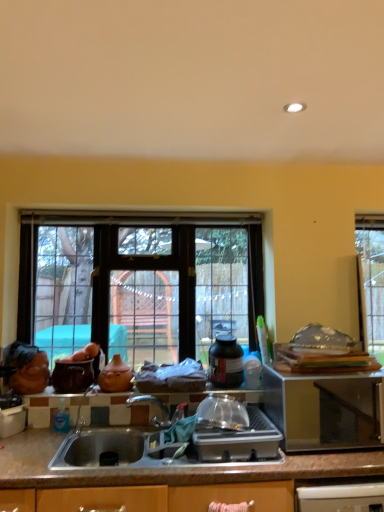
Question: From the image's perspective, is stainless steel microwave at right, which ranks as the second appliance in left-to-right order, positioned above or below matte brown pot at left, which is the first appliance from left to right?

Choices:
 (A) below
 (B) above

Answer: (A)

Question: Is point (294, 445) positioned closer to the camera than point (89, 379)?

Choices:
 (A) closer
 (B) farther

Answer: (B)

Question: Estimate the real-world distances between objects in this image. Which object is closer to the stainless steel microwave at right, positioned as the first appliance in right-to-left order?

Choices:
 (A) matte brown pot at left, which is the first appliance from left to right
 (B) clear glass window at center
 (C) matte black bottle at center, acting as the 1th bottle starting from the back
 (D) matte ceramic vase at center
 (E) brown granite countertop at lower center

Answer: (C)

Question: Based on their relative distances, which object is farther from the matte black bottle at center, which is the second bottle in bottom-to-top order?

Choices:
 (A) brown granite countertop at lower center
 (B) matte ceramic vase at center
 (C) blue translucent bottle at sink, which is counted as the 1th bottle, starting from the bottom
 (D) clear glass window at center
 (E) matte brown pot at left, which is the first appliance from left to right

Answer: (C)